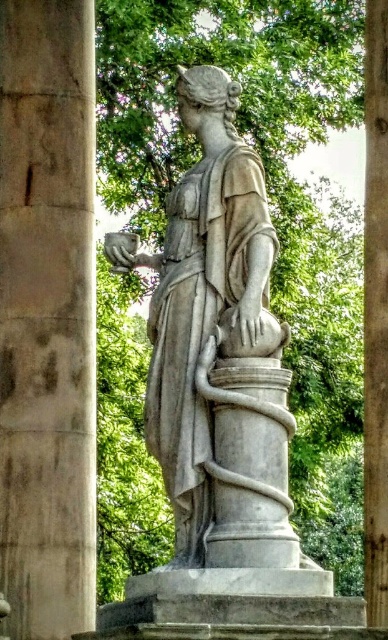
You are an art conservator examining the statue from the front. You notice two points on the statue marked at coordinates point (x=166, y=250) and point (x=382, y=42). Which point is nearer to your viewpoint?

Point (x=166, y=250) is closer to the camera than point (x=382, y=42).

You are a tour guide leading a group through a museum. You want to ensure that all visitors can see the white marble statue at center clearly from their current position. The recommended viewing distance for statues in this museum is between 50 to 70 meters. Is the current distance appropriate?

The white marble statue at center is 65.95 meters away from the camera, which falls within the recommended viewing distance range of 50 to 70 meters. Therefore, the current distance is appropriate for clear viewing.